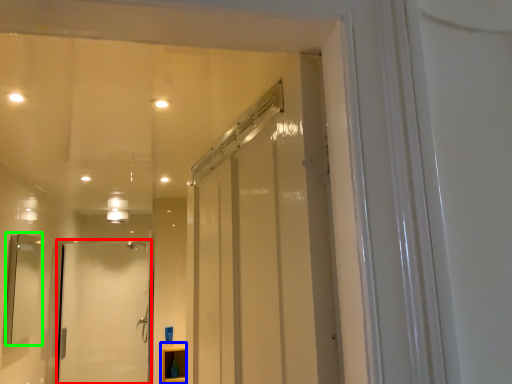
Question: Estimate the real-world distances between objects in this image. Which object is closer to door (highlighted by a red box), cabinetry (highlighted by a blue box) or mirror (highlighted by a green box)?

Choices:
 (A) cabinetry
 (B) mirror

Answer: (A)